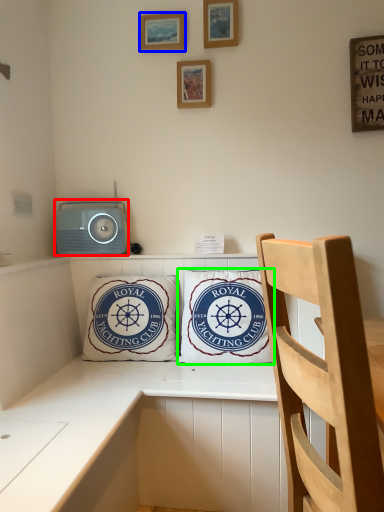
Question: Which object is positioned closest to stereo (highlighted by a red box)? Select from picture frame (highlighted by a blue box) and pillow (highlighted by a green box).

Choices:
 (A) picture frame
 (B) pillow

Answer: (B)